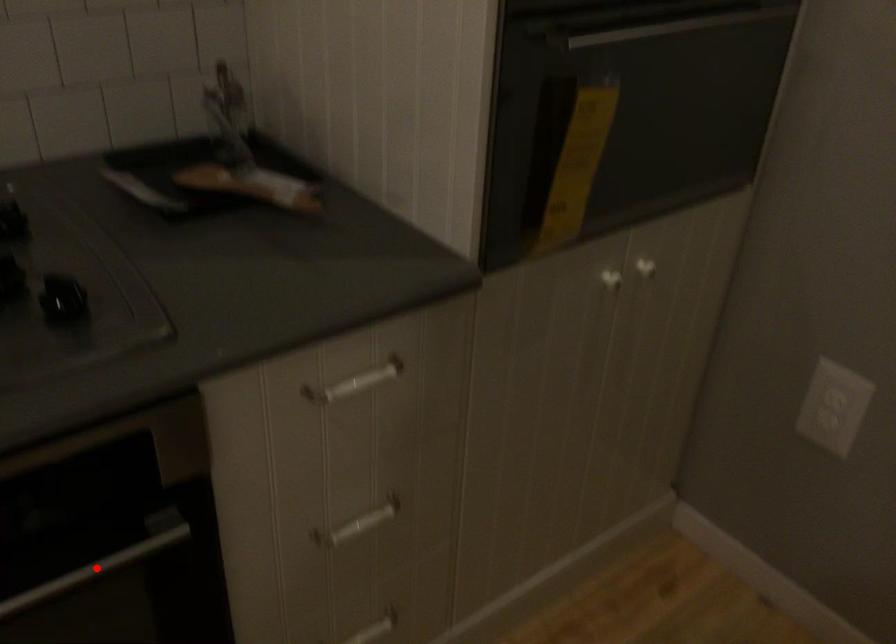
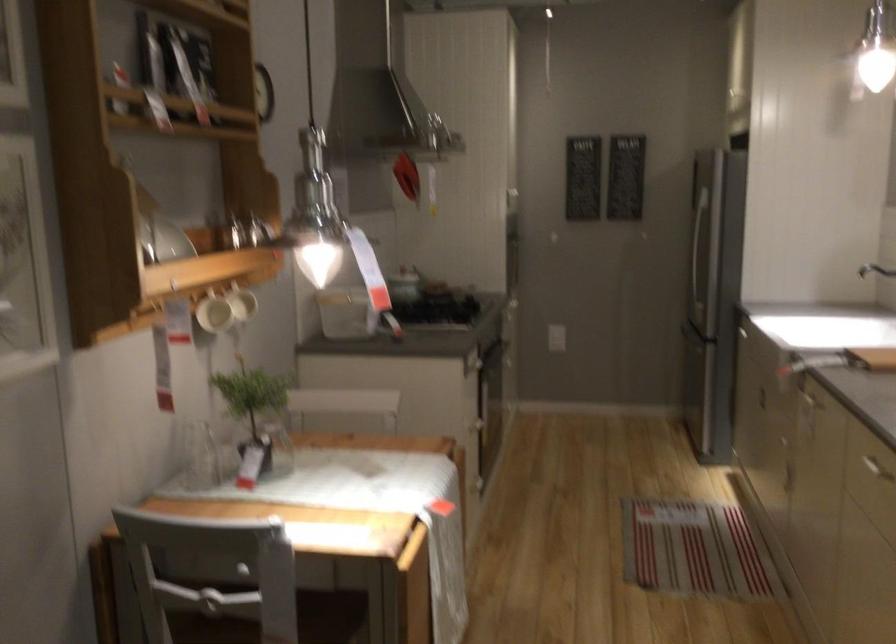
Question: I am providing you with two images of the same scene from different viewpoints. A red point is marked on the first image. Can you still see the location of the red point in image 2?

Choices:
 (A) Yes
 (B) No

Answer: (B)